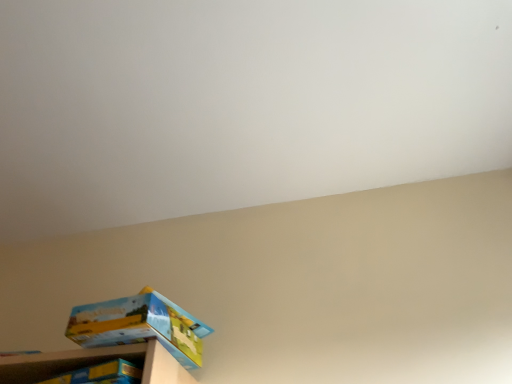
Describe the element at coordinates (95, 363) in the screenshot. The image size is (512, 384). I see `wooden shelf at lower left` at that location.

Locate an element on the screen. Image resolution: width=512 pixels, height=384 pixels. wooden shelf at lower left is located at coordinates (95, 363).

Describe the element at coordinates (139, 325) in the screenshot. I see `matte cardboard box at lower left` at that location.

The image size is (512, 384). Identify the location of matte cardboard box at lower left. (139, 325).

Locate an element on the screen. The height and width of the screenshot is (384, 512). wooden shelf at lower left is located at coordinates (95, 363).

Considering the relative positions of matte cardboard box at lower left and wooden shelf at lower left in the image provided, is matte cardboard box at lower left to the left of wooden shelf at lower left from the viewer's perspective?

No.

Considering their positions, is matte cardboard box at lower left located in front of or behind wooden shelf at lower left?

In the image, matte cardboard box at lower left appears behind wooden shelf at lower left.

Does point (162, 330) appear closer or farther from the camera than point (49, 355)?

Point (162, 330).

From the image's perspective, is matte cardboard box at lower left over wooden shelf at lower left?

Correct, matte cardboard box at lower left appears higher than wooden shelf at lower left in the image.

From a real-world perspective, is matte cardboard box at lower left below wooden shelf at lower left?

No, from a real-world perspective, matte cardboard box at lower left is not beneath wooden shelf at lower left.

Between matte cardboard box at lower left and wooden shelf at lower left, which one has larger width?

wooden shelf at lower left.

Consider the image. Is matte cardboard box at lower left shorter than wooden shelf at lower left?

In fact, matte cardboard box at lower left may be taller than wooden shelf at lower left.

Considering the sizes of objects matte cardboard box at lower left and wooden shelf at lower left in the image provided, who is bigger, matte cardboard box at lower left or wooden shelf at lower left?

With larger size is wooden shelf at lower left.

Can wooden shelf at lower left be found inside matte cardboard box at lower left?

Definitely not — wooden shelf at lower left is not inside matte cardboard box at lower left.

Is matte cardboard box at lower left positioned far away from wooden shelf at lower left?

Actually, matte cardboard box at lower left and wooden shelf at lower left are a little close together.

Is wooden shelf at lower left at the back of matte cardboard box at lower left?

No, wooden shelf at lower left is not at the back of matte cardboard box at lower left.

Consider the image. How many degrees apart are the facing directions of matte cardboard box at lower left and wooden shelf at lower left?

3.79 degrees separate the facing orientations of matte cardboard box at lower left and wooden shelf at lower left.

At what (x,y) coordinates should I click in order to perform the action: click on box lying above the wooden shelf at lower left (from the image's perspective). Please return your answer as a coordinate pair (x, y). Looking at the image, I should click on (139, 325).

Considering the positions of objects wooden shelf at lower left and matte cardboard box at lower left in the image provided, who is more to the right, wooden shelf at lower left or matte cardboard box at lower left?

From the viewer's perspective, matte cardboard box at lower left appears more on the right side.

Is wooden shelf at lower left positioned in front of matte cardboard box at lower left?

Yes.

Considering the points (96, 359) and (98, 318), which point is behind, point (96, 359) or point (98, 318)?

Positioned behind is point (96, 359).

From the image's perspective, is wooden shelf at lower left above or below matte cardboard box at lower left?

Based on their image positions, wooden shelf at lower left is located beneath matte cardboard box at lower left.

From a real-world perspective, is wooden shelf at lower left above or below matte cardboard box at lower left?

Clearly, from a real-world perspective, wooden shelf at lower left is below matte cardboard box at lower left.

Looking at their sizes, would you say wooden shelf at lower left is wider or thinner than matte cardboard box at lower left?

Clearly, wooden shelf at lower left has more width compared to matte cardboard box at lower left.

Consider the image. Considering the relative sizes of wooden shelf at lower left and matte cardboard box at lower left in the image provided, is wooden shelf at lower left taller than matte cardboard box at lower left?

No, wooden shelf at lower left is not taller than matte cardboard box at lower left.

Considering the sizes of objects wooden shelf at lower left and matte cardboard box at lower left in the image provided, who is bigger, wooden shelf at lower left or matte cardboard box at lower left?

wooden shelf at lower left.

Could matte cardboard box at lower left be considered to be inside wooden shelf at lower left?

Actually, matte cardboard box at lower left is outside wooden shelf at lower left.

Is wooden shelf at lower left next to matte cardboard box at lower left?

Yes, wooden shelf at lower left is next to matte cardboard box at lower left.

Is wooden shelf at lower left looking in the opposite direction of matte cardboard box at lower left?

No, wooden shelf at lower left is not facing the opposite direction of matte cardboard box at lower left.

Identify the location of shelf directly beneath the matte cardboard box at lower left (from a real-world perspective). (95, 363).

Where is `box located above the wooden shelf at lower left (from the image's perspective)`? Image resolution: width=512 pixels, height=384 pixels. box located above the wooden shelf at lower left (from the image's perspective) is located at coordinates (139, 325).

Image resolution: width=512 pixels, height=384 pixels. Find the location of `shelf in front of the matte cardboard box at lower left`. shelf in front of the matte cardboard box at lower left is located at coordinates (95, 363).